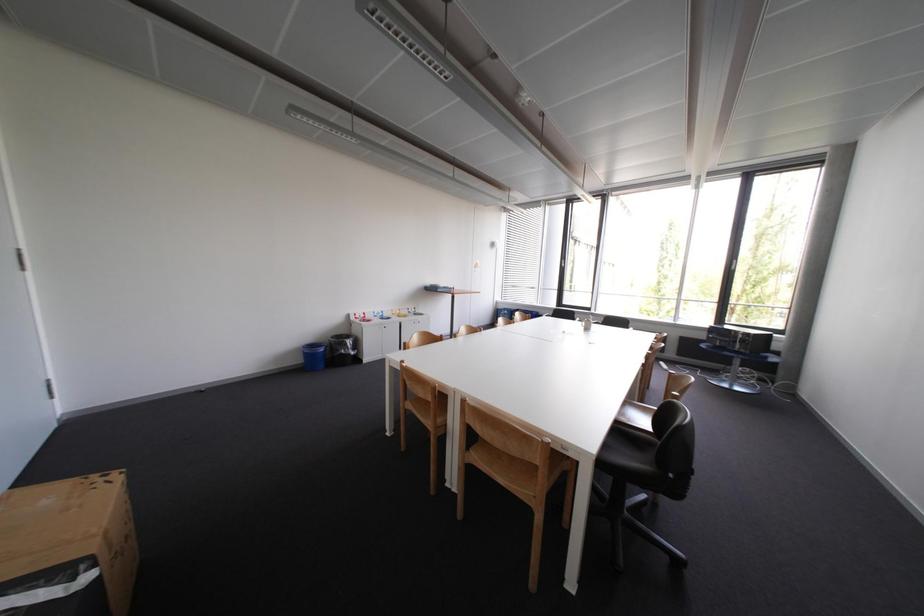
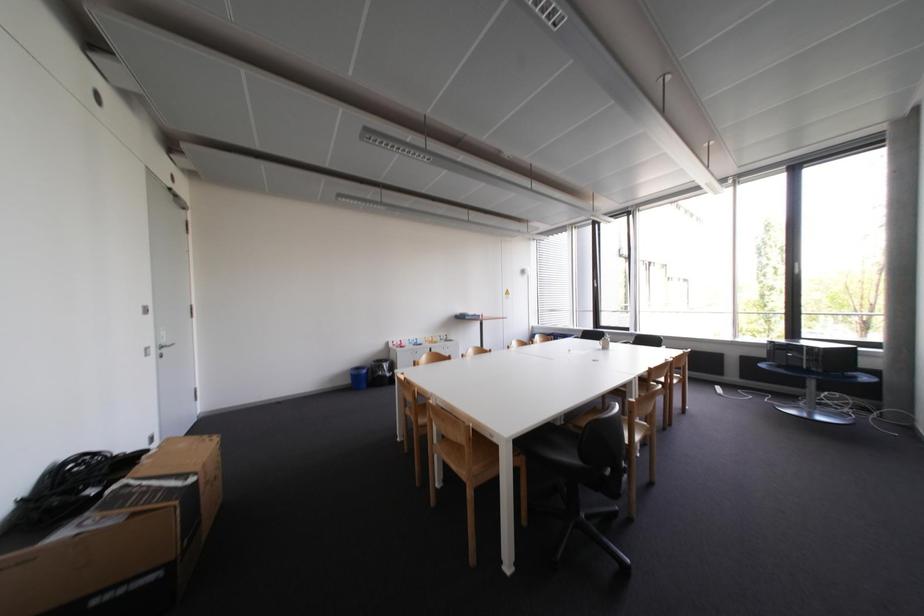
Question: Based on the continuous images, in which direction is the camera rotating? Reply with the corresponding letter.

Choices:
 (A) Left
 (B) Right
 (C) Up
 (D) Down

Answer: (A)